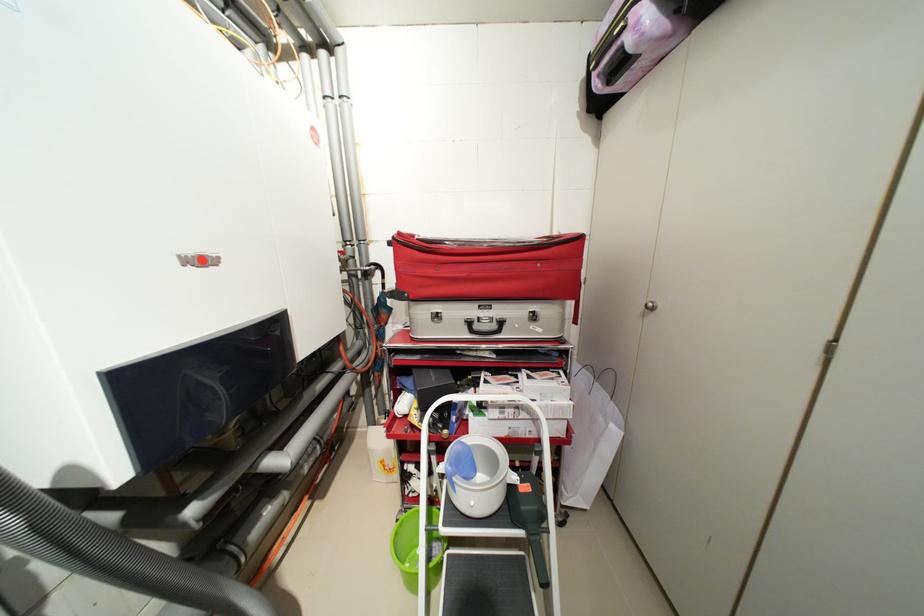
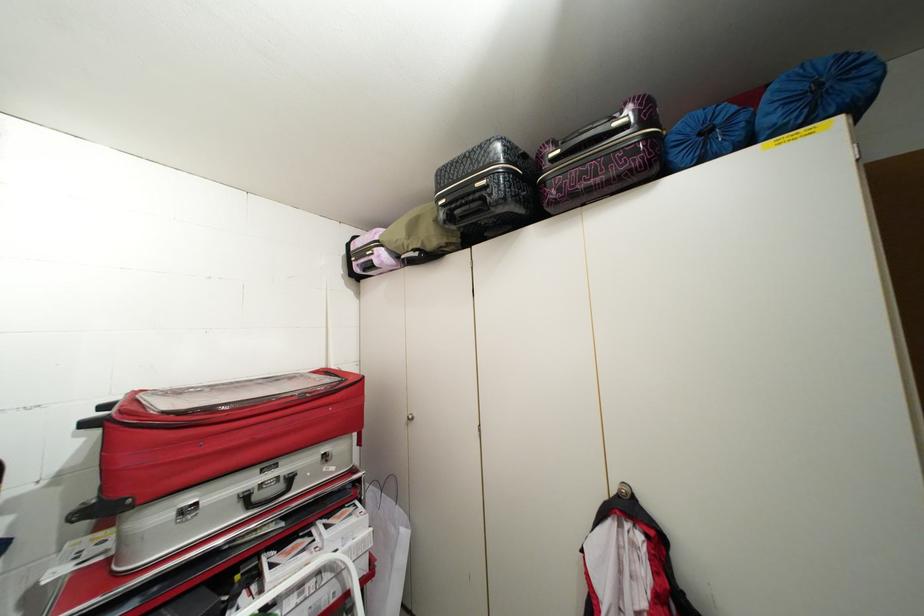
Question: Based on the continuous images, in which direction is the camera rotating? Reply with the corresponding letter.

Choices:
 (A) Left
 (B) Right
 (C) Up
 (D) Down

Answer: (B)